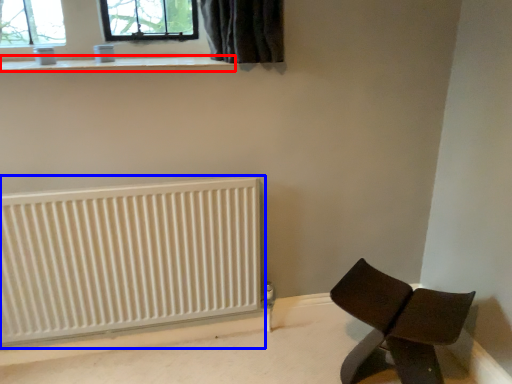
Question: Which of the following is the closest to the observer, window sill (highlighted by a red box) or radiator (highlighted by a blue box)?

Choices:
 (A) window sill
 (B) radiator

Answer: (A)